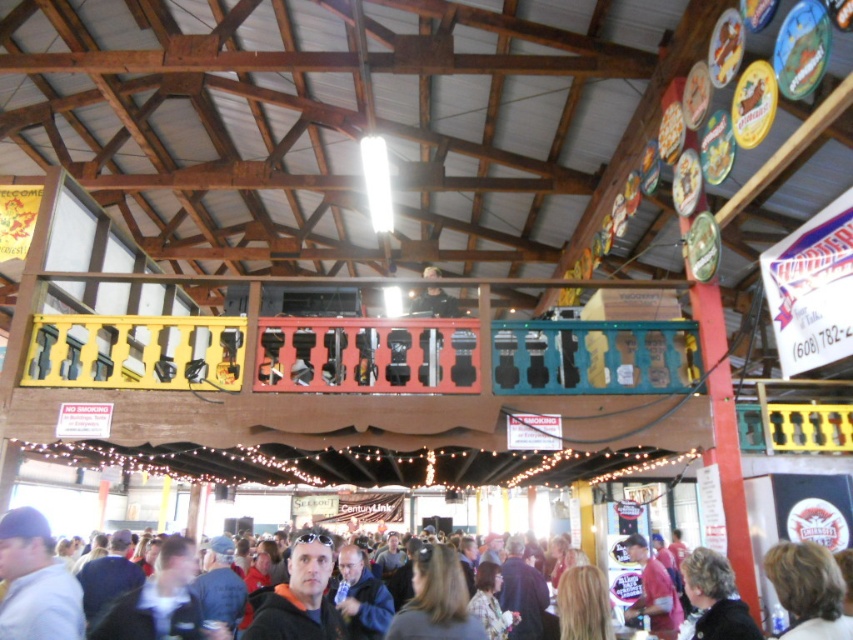
Question: Does dark blue jacket at center appear on the right side of light blue baseball cap at lower left?

Choices:
 (A) yes
 (B) no

Answer: (B)

Question: Among these points, which one is nearest to the camera?

Choices:
 (A) (59, 580)
 (B) (134, 637)

Answer: (A)

Question: Which object appears farthest from the camera in this image?

Choices:
 (A) dark blue jacket at center
 (B) light blue baseball cap at lower left

Answer: (A)

Question: Does dark blue jacket at center come behind light blue baseball cap at lower left?

Choices:
 (A) no
 (B) yes

Answer: (B)

Question: Which point is closer to the camera?

Choices:
 (A) (55, 612)
 (B) (198, 634)

Answer: (A)

Question: Is dark blue jacket at center to the right of light blue baseball cap at lower left from the viewer's perspective?

Choices:
 (A) yes
 (B) no

Answer: (B)